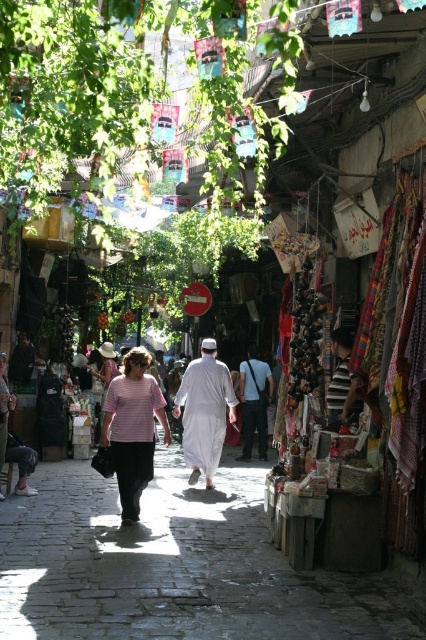
You are a traveler carrying a backpack and want to buy a fabric item that can easily fit inside your bag. You see the white cotton robe at center and the dark gray fabric at center. Which one should you choose?

The dark gray fabric at center is smaller in size compared to the white cotton robe at center, so it would fit better inside your backpack.

You are a traveler walking down the smooth stone path at center in the market. You want to know if there is enough space to pass by the pink fabric dress at center without touching it. Can you do so?

The smooth stone path at center occupies less space than the pink fabric dress at center, so there may not be enough space to pass by the pink fabric dress at center without touching it.